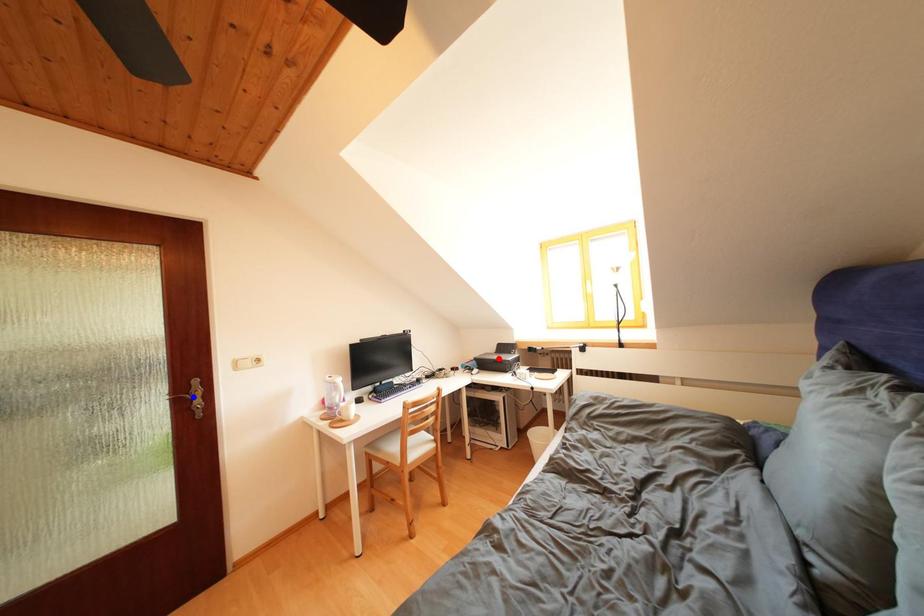
Question: Two points are marked on the image. Which point is closer to the camera?

Choices:
 (A) Blue point is closer.
 (B) Red point is closer.

Answer: (A)